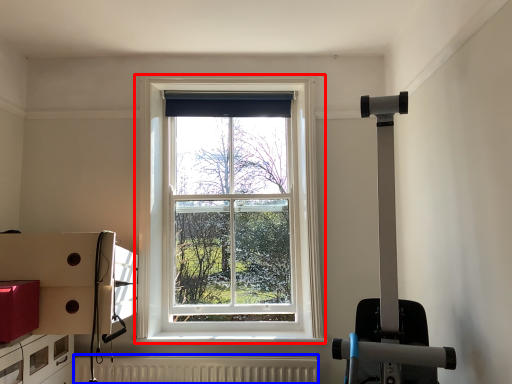
Question: Among these objects, which one is farthest to the camera, window (highlighted by a red box) or radiator (highlighted by a blue box)?

Choices:
 (A) window
 (B) radiator

Answer: (A)